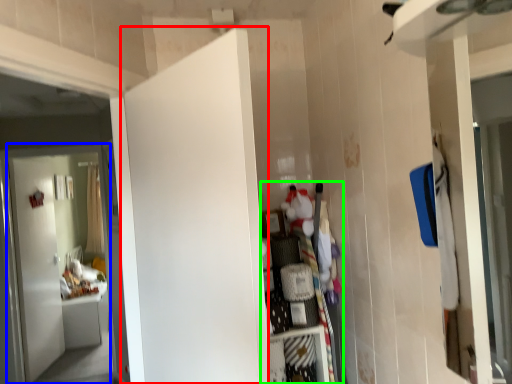
Question: Which object is positioned farthest from door (highlighted by a red box)? Select from door (highlighted by a blue box) and dresser (highlighted by a green box).

Choices:
 (A) door
 (B) dresser

Answer: (A)